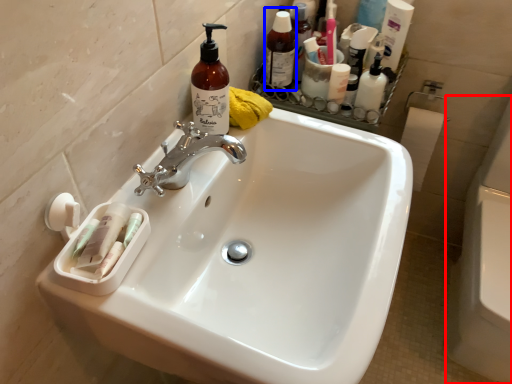
Question: Which object is further to the camera taking this photo, bath (highlighted by a red box) or toiletry (highlighted by a blue box)?

Choices:
 (A) bath
 (B) toiletry

Answer: (B)